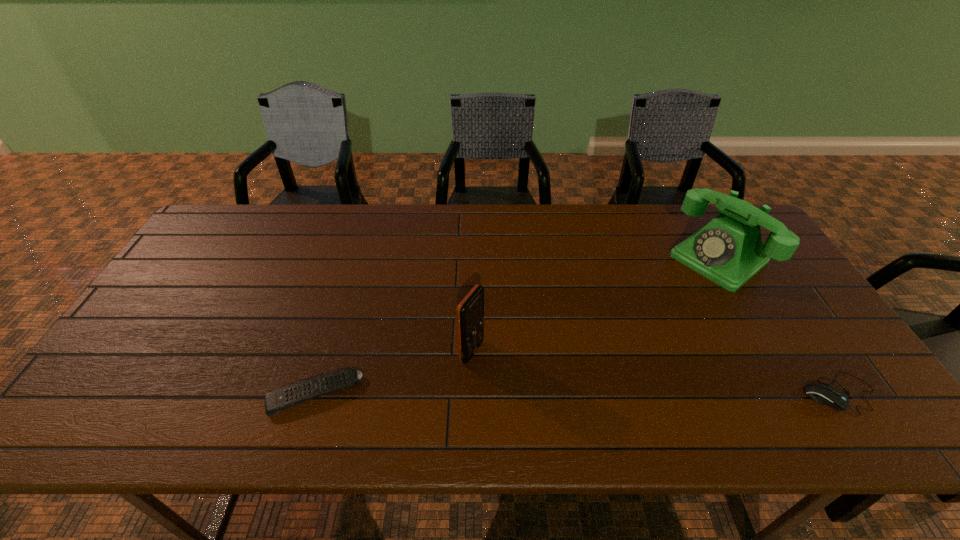
Image resolution: width=960 pixels, height=540 pixels. What are the coordinates of `remote control` in the screenshot? It's located at (278, 400).

This screenshot has height=540, width=960. What are the coordinates of `the shortest object` in the screenshot? It's located at (278, 400).

In order to click on computer mouse in this screenshot , I will do `click(833, 397)`.

Find the location of a particular element. This screenshot has height=540, width=960. telephone is located at coordinates (729, 251).

Locate an element on the screen. The width and height of the screenshot is (960, 540). the second object from left to right is located at coordinates (470, 312).

The height and width of the screenshot is (540, 960). I want to click on cellular telephone, so click(x=470, y=312).

Locate an element on the screen. The width and height of the screenshot is (960, 540). vacant space located 0.340m on the back of the remote control is located at coordinates (350, 275).

Where is `vacant space positioned 0.100m on the left of the computer mouse`? vacant space positioned 0.100m on the left of the computer mouse is located at coordinates 760,393.

I want to click on free spot located on the dial of the telephone, so click(678, 289).

Locate an element on the screen. The image size is (960, 540). vacant space situated 0.140m on the dial of the telephone is located at coordinates (663, 301).